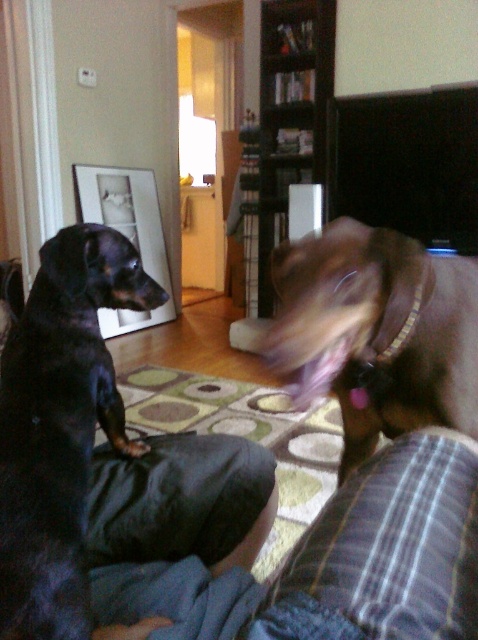
From the picture: You are a photographer trying to capture a closeup of the black smooth dog at left and the brown smooth dog at center. Which dog should you focus on first to ensure the closest subject is in sharp focus?

The black smooth dog at left is closer to the viewer than the brown smooth dog at center, so you should focus on the black smooth dog at left first to ensure the closest subject is in sharp focus.

You are a dog trainer observing the black smooth dog at left and the brown smooth dog at center. Which dog is located lower in the image?

The black smooth dog at left is positioned under the brown smooth dog at center, so it is lower in the image.

Looking at this image, you are a dog trainer assessing the physical condition of the dogs in the image. Based on the black smooth dog at left and the brown smooth dog at center, which dog has a more slender body structure?

The black smooth dog at left has a more slender body structure as it is thinner than the brown smooth dog at center.